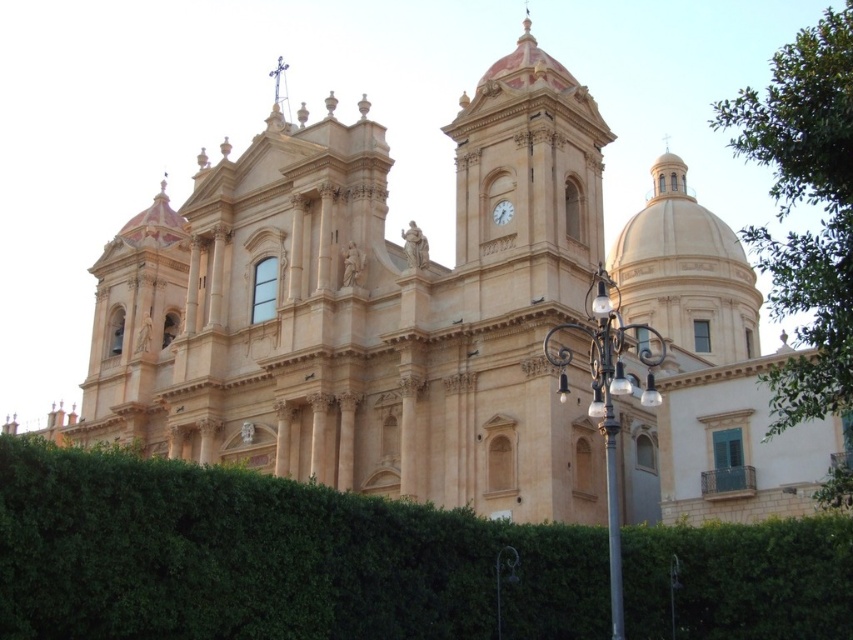
You are standing at the point marked as point (819, 186). You want to walk to the nearest entrance of the cathedral. The cathedral has two entrances. The left entrance is 20 meters away from your current position, and the right entrance is 35 meters away. Which entrance should you go to reach the entrance faster?

You should go to the left entrance because it is closer at 20 meters compared to the right entrance at 35 meters.

You are standing in front of the grand building and want to take a photo of the green leafy bush at center and the black wrought iron streetlight at lower right. Which object should you focus on first if you want both to be in sharp focus?

The green leafy bush at center is closer to the viewer than the black wrought iron streetlight at lower right, so you should focus on the green leafy bush at center first to ensure both are in sharp focus.

You are standing in front of the grand church and notice two points marked on the facade. The first point is at coordinates point (807, 120) and the second is at point (492, 211). Which of these points is closer to you as you face the church?

Point (807, 120) is in front of point (492, 211), so it is closer to you as you face the church.